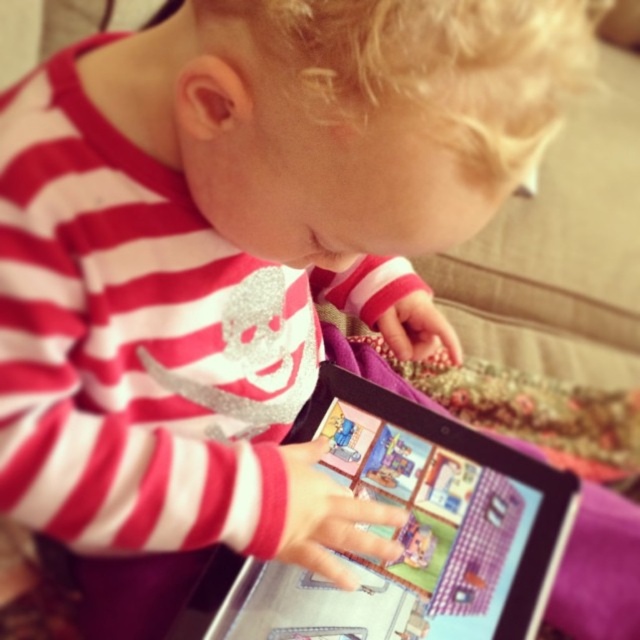
From the picture: Please provide the coordinates of the silver metallic tablet at center in the image. The coordinate system is from 0 to 1 in both x and y directions, with the origin at the bottom left corner.

The silver metallic tablet at center is located at coordinates point (410, 529).

You are a toy designer observing the child interacting with the tablet. Which tablet is physically nearer to the child, the silver metallic tablet at center or the matte plastic tablet at center?

The silver metallic tablet at center is closer to the viewer than the matte plastic tablet at center, so the silver metallic tablet at center is physically nearer to the child.